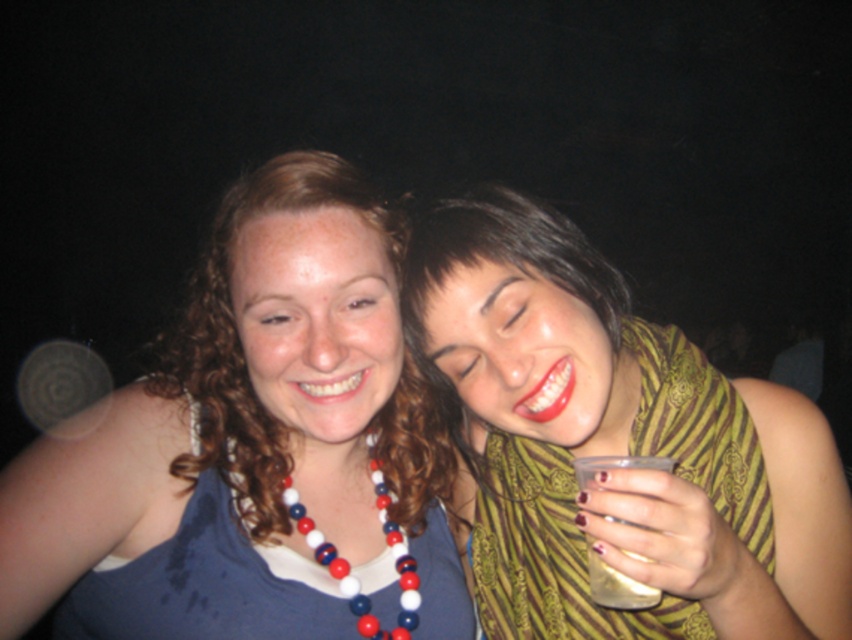
Question: Which point is farther from the camera taking this photo?

Choices:
 (A) (400, 627)
 (B) (781, 624)

Answer: (A)

Question: In this image, where is red and white beads at center located relative to clear plastic cup at right?

Choices:
 (A) left
 (B) right

Answer: (A)

Question: Which point appears farthest from the camera in this image?

Choices:
 (A) (551, 321)
 (B) (597, 577)

Answer: (A)

Question: Can you confirm if red and white beads at center is smaller than clear plastic cup at right?

Choices:
 (A) no
 (B) yes

Answer: (A)

Question: Which of the following is the farthest from the observer?

Choices:
 (A) (803, 572)
 (B) (393, 531)
 (C) (642, 593)
 (D) (183, 381)

Answer: (B)

Question: Can you confirm if matte blue tank top at center is positioned above clear plastic cup at right?

Choices:
 (A) yes
 (B) no

Answer: (A)